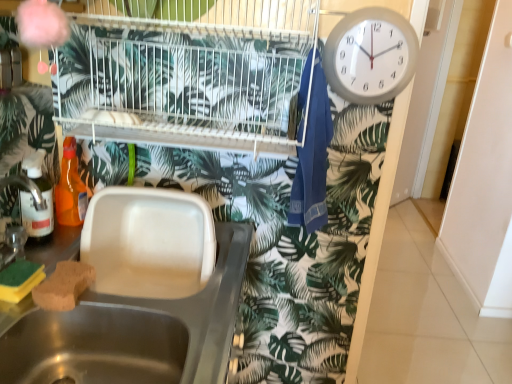
What is the approximate height of white glossy screen door at right?

Result: white glossy screen door at right is 1.63 meters in height.

The width and height of the screenshot is (512, 384). What do you see at coordinates (485, 181) in the screenshot? I see `white glossy screen door at right` at bounding box center [485, 181].

This screenshot has height=384, width=512. What do you see at coordinates (19, 280) in the screenshot? I see `green sponge at lower left, arranged as the second food when viewed from the right` at bounding box center [19, 280].

The width and height of the screenshot is (512, 384). Describe the element at coordinates (70, 188) in the screenshot. I see `translucent orange bottle at left, marked as the 1th bottle in a back-to-front arrangement` at that location.

The width and height of the screenshot is (512, 384). Describe the element at coordinates (370, 55) in the screenshot. I see `white plastic clock at upper right` at that location.

You are a GUI agent. You are given a task and a screenshot of the screen. Output one action in this format:
    pyautogui.click(x=<x>, y=<y>)
    Task: Click on the white plastic sink at lower left
    The height and width of the screenshot is (384, 512).
    Given the screenshot: What is the action you would take?
    pyautogui.click(x=134, y=332)

Based on the photo, is there a large distance between brown sponge at sink left, which is counted as the first food, starting from the right, and white plastic sink at lower left?

brown sponge at sink left, which is counted as the first food, starting from the right, is actually quite close to white plastic sink at lower left.

Which of these two, brown sponge at sink left, which is counted as the first food, starting from the right, or white plastic sink at lower left, is smaller?

With smaller size is brown sponge at sink left, which is counted as the first food, starting from the right.

Consider the image. Between brown sponge at sink left, which is counted as the first food, starting from the right, and white plastic sink at lower left, which one is positioned in front?

white plastic sink at lower left is closer to the camera.

From a real-world perspective, does translucent orange bottle at left, marked as the 1th bottle in a back-to-front arrangement, sit lower than green sponge at lower left, arranged as the second food when viewed from the right?

No, from a real-world perspective, translucent orange bottle at left, marked as the 1th bottle in a back-to-front arrangement, is not below green sponge at lower left, arranged as the second food when viewed from the right.

Is translucent orange bottle at left, marked as the 1th bottle in a back-to-front arrangement, touching green sponge at lower left, the first food when ordered from left to right?

translucent orange bottle at left, marked as the 1th bottle in a back-to-front arrangement, is not next to green sponge at lower left, the first food when ordered from left to right, and they're not touching.

Is translucent orange bottle at left, which is the 2th bottle in front-to-back order, outside of green sponge at lower left, the first food when ordered from left to right?

translucent orange bottle at left, which is the 2th bottle in front-to-back order, lies outside green sponge at lower left, the first food when ordered from left to right,'s area.

Looking at the image, does translucent orange bottle at left, which is the 2th bottle in front-to-back order, seem bigger or smaller compared to green sponge at lower left, arranged as the second food when viewed from the right?

Considering their sizes, translucent orange bottle at left, which is the 2th bottle in front-to-back order, takes up more space than green sponge at lower left, arranged as the second food when viewed from the right.

Consider the image. Are white glossy screen door at right and white plastic sink at lower left far apart?

Indeed, white glossy screen door at right is not near white plastic sink at lower left.

How far apart are white glossy screen door at right and white plastic sink at lower left?

white glossy screen door at right and white plastic sink at lower left are 6.19 feet apart.

Does point (461, 222) appear closer or farther from the camera than point (238, 239)?

Point (461, 222) is farther from the camera than point (238, 239).

Does white glossy screen door at right have a greater width compared to white plastic clock at upper right?

Correct, the width of white glossy screen door at right exceeds that of white plastic clock at upper right.

Is white glossy screen door at right in contact with white plastic clock at upper right?

No, white glossy screen door at right is not touching white plastic clock at upper right.

Where is `screen door above the white plastic clock at upper right (from the image's perspective)`? This screenshot has height=384, width=512. screen door above the white plastic clock at upper right (from the image's perspective) is located at coordinates (485, 181).

From a real-world perspective, which object stands above the other?

In real-world perspective, white plastic clock at upper right is above.

Considering the sizes of objects translucent plastic bottle at left, which is the 2th bottle in back-to-front order, and green sponge at lower left, the first food when ordered from left to right, in the image provided, who is thinner, translucent plastic bottle at left, which is the 2th bottle in back-to-front order, or green sponge at lower left, the first food when ordered from left to right,?

Thinner between the two is green sponge at lower left, the first food when ordered from left to right.

Can you confirm if translucent plastic bottle at left, which is the 2th bottle in back-to-front order, is bigger than green sponge at lower left, the first food when ordered from left to right?

Indeed, translucent plastic bottle at left, which is the 2th bottle in back-to-front order, has a larger size compared to green sponge at lower left, the first food when ordered from left to right.

Is green sponge at lower left, the first food when ordered from left to right, inside translucent plastic bottle at left, which is the 2th bottle in back-to-front order?

No, green sponge at lower left, the first food when ordered from left to right, is not a part of translucent plastic bottle at left, which is the 2th bottle in back-to-front order.

Is translucent plastic bottle at left, the first bottle viewed from the front, in contact with brown sponge at sink left, which ranks as the 2th food in left-to-right order?

translucent plastic bottle at left, the first bottle viewed from the front, and brown sponge at sink left, which ranks as the 2th food in left-to-right order, are clearly separated.

Which object is thinner, translucent plastic bottle at left, the first bottle viewed from the front, or brown sponge at sink left, which is counted as the first food, starting from the right?

translucent plastic bottle at left, the first bottle viewed from the front.

Does translucent plastic bottle at left, the first bottle viewed from the front, come behind brown sponge at sink left, which ranks as the 2th food in left-to-right order?

Yes, it is.

Which of these two, translucent plastic bottle at left, which is the 2th bottle in back-to-front order, or brown sponge at sink left, which ranks as the 2th food in left-to-right order, stands taller?

With more height is translucent plastic bottle at left, which is the 2th bottle in back-to-front order.

Based on the photo, from a real-world perspective, does green sponge at lower left, arranged as the second food when viewed from the right, stand above white glossy screen door at right?

Yes, from a real-world perspective, green sponge at lower left, arranged as the second food when viewed from the right, is above white glossy screen door at right.

The image size is (512, 384). What are the coordinates of `screen door below the green sponge at lower left, arranged as the second food when viewed from the right (from a real-world perspective)` in the screenshot? It's located at pos(485,181).

Measure the distance from green sponge at lower left, arranged as the second food when viewed from the right, to white glossy screen door at right.

A distance of 2.37 meters exists between green sponge at lower left, arranged as the second food when viewed from the right, and white glossy screen door at right.

Which point is more forward, (x=17, y=271) or (x=460, y=252)?

The point (x=17, y=271) is closer.

From the image's perspective, which food is the 1st one above the white plastic sink at lower left? Please provide its 2D coordinates.

[(64, 286)]

The image size is (512, 384). There is a translucent orange bottle at left, which is the 2th bottle in front-to-back order. Identify the location of the 1st food below it (from the image's perspective). (19, 280).

Looking at the image, which one is located further to white plastic clock at upper right, green sponge at lower left, the first food when ordered from left to right, or white wire bird cage at upper center?

green sponge at lower left, the first food when ordered from left to right, lies further to white plastic clock at upper right than the other object.

Which object lies nearer to the anchor point blue fabric laundry at upper right, brown sponge at sink left, which ranks as the 2th food in left-to-right order, or white glossy screen door at right?

brown sponge at sink left, which ranks as the 2th food in left-to-right order, lies closer to blue fabric laundry at upper right than the other object.

From the image, which object appears to be nearer to brown sponge at sink left, which is counted as the first food, starting from the right, white plastic sink at lower left or white plastic clock at upper right?

white plastic sink at lower left is positioned closer to the anchor brown sponge at sink left, which is counted as the first food, starting from the right.

Which object lies nearer to the anchor point white plastic clock at upper right, translucent orange bottle at left, which is the 2th bottle in front-to-back order, or translucent plastic bottle at left, which is the 2th bottle in back-to-front order?

The object closer to white plastic clock at upper right is translucent orange bottle at left, which is the 2th bottle in front-to-back order.

Which object lies further to the anchor point green sponge at lower left, arranged as the second food when viewed from the right, white plastic clock at upper right or translucent orange bottle at left, which is the 2th bottle in front-to-back order?

white plastic clock at upper right lies further to green sponge at lower left, arranged as the second food when viewed from the right, than the other object.

Based on their spatial positions, is brown sponge at sink left, which is counted as the first food, starting from the right, or white wire bird cage at upper center further from blue fabric laundry at upper right?

Based on the image, brown sponge at sink left, which is counted as the first food, starting from the right, appears to be further to blue fabric laundry at upper right.

Which object lies nearer to the anchor point white plastic sink at lower left, white plastic clock at upper right or white glossy screen door at right?

The object closer to white plastic sink at lower left is white plastic clock at upper right.

When comparing their distances from white plastic clock at upper right, does white glossy screen door at right or brown sponge at sink left, which ranks as the 2th food in left-to-right order, seem further?

white glossy screen door at right.

The width and height of the screenshot is (512, 384). Identify the location of bird cage located between translucent orange bottle at left, which is the 2th bottle in front-to-back order, and white plastic clock at upper right in the left-right direction. (186, 72).

Where is `food between brown sponge at sink left, which is counted as the first food, starting from the right, and translucent orange bottle at left, which is the 2th bottle in front-to-back order, in the front-back direction`? food between brown sponge at sink left, which is counted as the first food, starting from the right, and translucent orange bottle at left, which is the 2th bottle in front-to-back order, in the front-back direction is located at coordinates (19, 280).

This screenshot has height=384, width=512. I want to click on food between green sponge at lower left, arranged as the second food when viewed from the right, and white plastic sink at lower left from top to bottom, so [64, 286].

Where is `bird cage between green sponge at lower left, arranged as the second food when viewed from the right, and white plastic clock at upper right`? bird cage between green sponge at lower left, arranged as the second food when viewed from the right, and white plastic clock at upper right is located at coordinates click(186, 72).